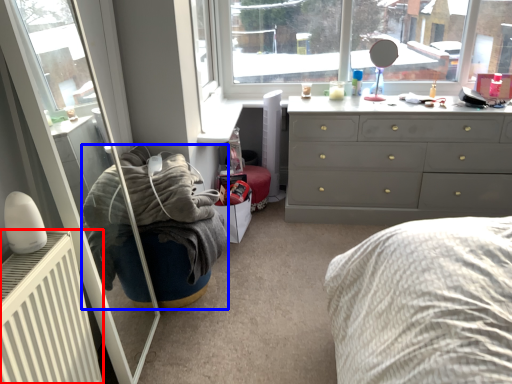
Question: Which point is further to the camera, radiator (highlighted by a red box) or bean bag chair (highlighted by a blue box)?

Choices:
 (A) radiator
 (B) bean bag chair

Answer: (B)